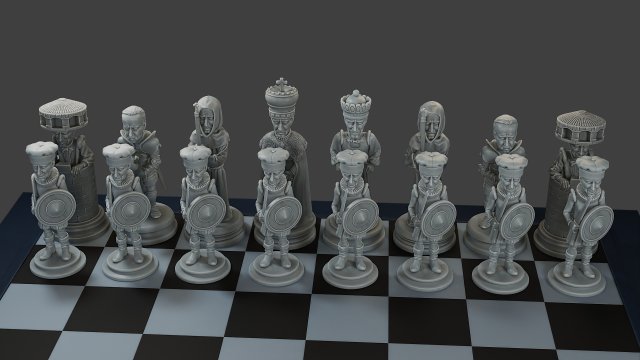
The height and width of the screenshot is (360, 640). Find the location of `chess board`. chess board is located at coordinates (109, 342), (173, 313), (257, 321), (337, 347).